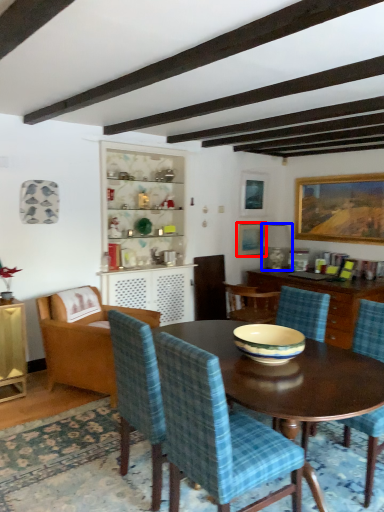
Question: Among these objects, which one is farthest to the camera, picture frame (highlighted by a red box) or lamp (highlighted by a blue box)?

Choices:
 (A) picture frame
 (B) lamp

Answer: (A)